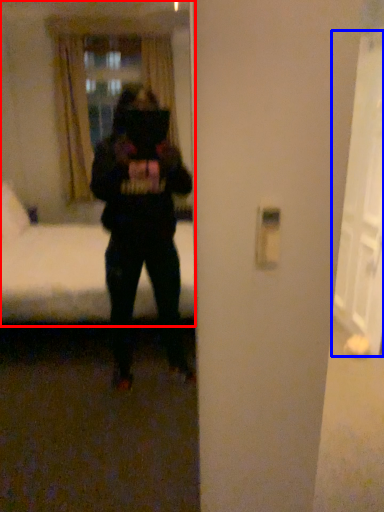
Question: Which object is further to the camera taking this photo, mirror (highlighted by a red box) or glass door (highlighted by a blue box)?

Choices:
 (A) mirror
 (B) glass door

Answer: (B)